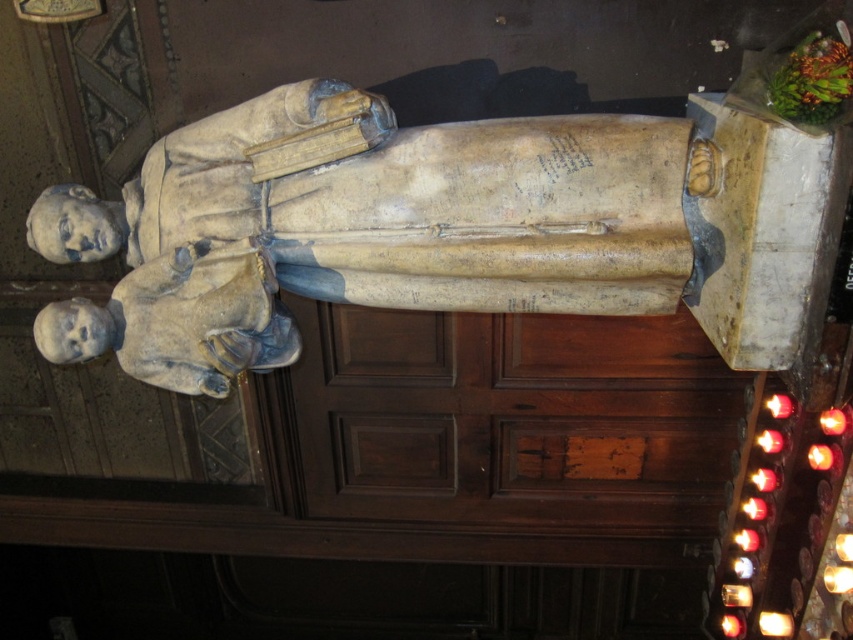
You are a visitor standing in front of the beige stone statue at center. You want to take a photo of it without getting too close. If your camera can focus on objects up to 2 meters away, will you be able to take a clear photo from your current position?

The beige stone statue at center is 2.32 meters away from you, which is beyond the camera focus range of 2 meters. Therefore, you will not be able to take a clear photo from your current position.